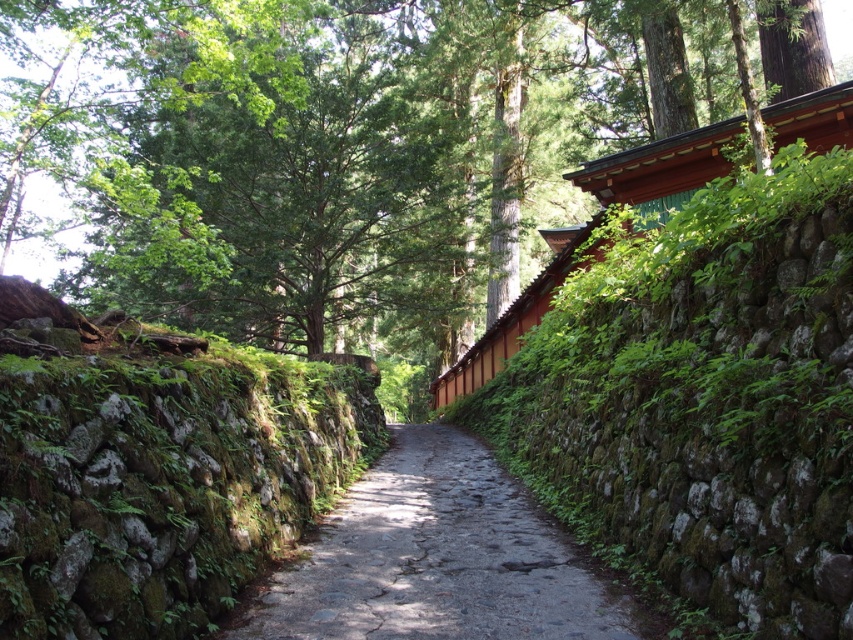
Question: Does green leafy tree at upper center appear over green mossy stone wall at left?

Choices:
 (A) yes
 (B) no

Answer: (A)

Question: Which of these objects is positioned farthest from the green leafy tree at upper center?

Choices:
 (A) green mossy stone wall at left
 (B) gray stone path at center

Answer: (B)

Question: Is green mossy stone wall at left smaller than gray stone path at center?

Choices:
 (A) no
 (B) yes

Answer: (A)

Question: Is green leafy tree at upper center closer to camera compared to gray stone path at center?

Choices:
 (A) no
 (B) yes

Answer: (A)

Question: Which object appears closest to the camera in this image?

Choices:
 (A) green leafy tree at upper center
 (B) green mossy stone wall at left
 (C) gray stone path at center

Answer: (B)

Question: Which point is farther from the camera taking this photo?

Choices:
 (A) (200, 122)
 (B) (524, 547)
 (C) (247, 445)

Answer: (A)